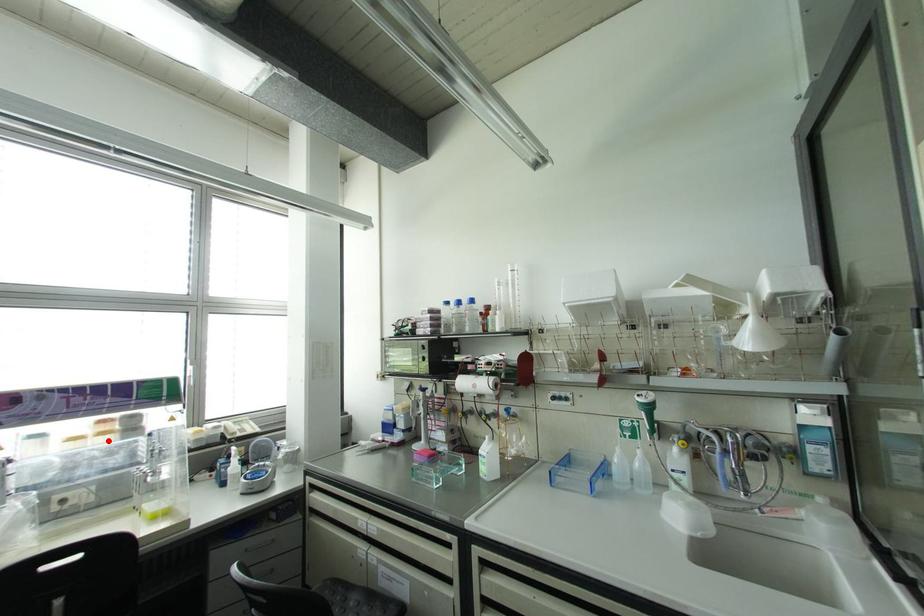
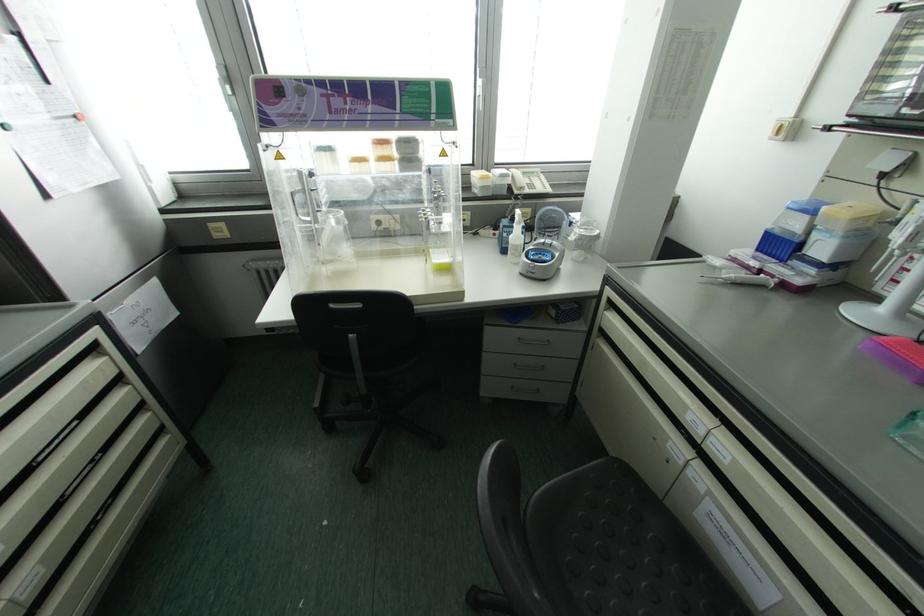
In the second image, find the point that corresponds to the highlighted location in the first image.

(393, 169)